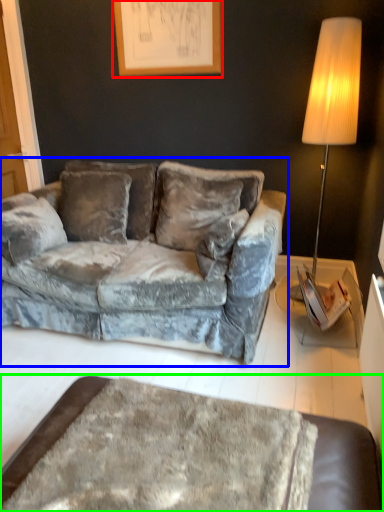
Question: Estimate the real-world distances between objects in this image. Which object is closer to picture frame (highlighted by a red box), studio couch (highlighted by a blue box) or table (highlighted by a green box)?

Choices:
 (A) studio couch
 (B) table

Answer: (A)